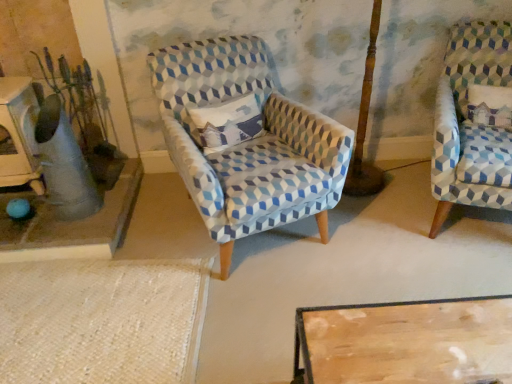
Question: Considering the relative positions of blue-patterned fabric chair at right, which is counted as the 2th chair, starting from the left, and matte gray vase at left in the image provided, is blue-patterned fabric chair at right, which is counted as the 2th chair, starting from the left, to the left or to the right of matte gray vase at left?

Choices:
 (A) right
 (B) left

Answer: (A)

Question: From their relative heights in the image, would you say blue-patterned fabric chair at right, positioned as the first chair in right-to-left order, is taller or shorter than matte gray vase at left?

Choices:
 (A) tall
 (B) short

Answer: (A)

Question: Based on their relative distances, which object is farther from the matte gray vase at left?

Choices:
 (A) blue-patterned fabric chair at right, which is counted as the 2th chair, starting from the left
 (B) matte gray concrete table at left
 (C) blue patterned fabric chair at center, the 2th chair positioned from the right

Answer: (A)

Question: Estimate the real-world distances between objects in this image. Which object is farther from the matte gray vase at left?

Choices:
 (A) blue patterned fabric chair at center, the 2th chair positioned from the right
 (B) blue-patterned fabric chair at right, which is counted as the 2th chair, starting from the left
 (C) matte gray concrete table at left

Answer: (B)